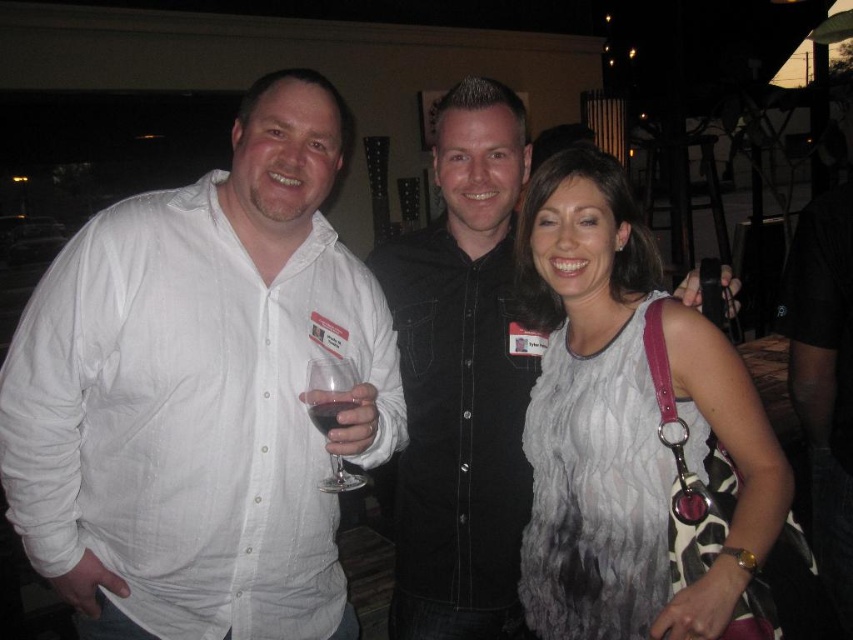
Does white textured dress at center have a lesser width compared to transparent glass at center?

No.

Does white textured dress at center appear over transparent glass at center?

Yes.

Does point (582, 333) lie behind point (347, 365)?

Yes, point (582, 333) is behind point (347, 365).

The image size is (853, 640). Find the location of `white textured dress at center`. white textured dress at center is located at coordinates (625, 422).

Measure the distance between white textured dress at center and camera.

They are 3.83 feet apart.

Is white textured dress at center wider than dark red liquid at center?

Yes, white textured dress at center is wider than dark red liquid at center.

Is point (556, 328) farther from camera compared to point (345, 410)?

Yes.

Locate an element on the screen. Image resolution: width=853 pixels, height=640 pixels. white textured dress at center is located at coordinates (625, 422).

Is white linen shirt at left thinner than dark red liquid at center?

No, white linen shirt at left is not thinner than dark red liquid at center.

Locate an element on the screen. The image size is (853, 640). white linen shirt at left is located at coordinates (201, 394).

Where is `white linen shirt at left`? This screenshot has height=640, width=853. white linen shirt at left is located at coordinates (201, 394).